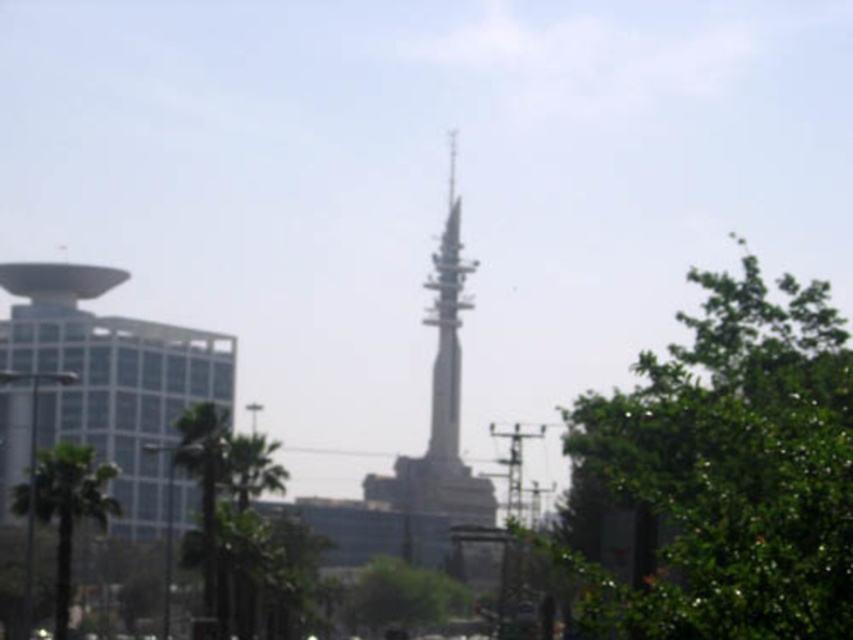
You are a pedestrian standing on the sidewalk and see both the white glass building at left and the green leafy tree at center. Which object is closer to you?

The white glass building at left is closer to you because it is positioned in front of the green leafy tree at center.

Looking at this image, you are standing at the base of the modern tower and want to take a photo of the point at coordinates point (828, 604). If your camera has a maximum zoom range of 25 feet, will you be able to capture the point in the photo without moving closer?

The distance between you and the point (828, 604) is 31.26 feet, which exceeds the camera maximum zoom range of 25 feet. Therefore, you will not be able to capture the point in the photo without moving closer.

You are a city planner assessing the urban space. You need to determine if the green leafy tree at right will block the view of the metallic spire at center from the road. Can you confirm if the tree is shorter than the spire?

The green leafy tree at right is not as tall as metallic spire at center, so the tree will not block the view of the spire from the road.